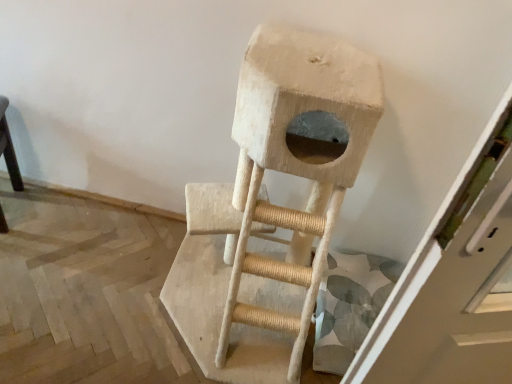
The width and height of the screenshot is (512, 384). What are the coordinates of `vacant space positioned to the left of natural wood cat tree at center` in the screenshot? It's located at (95, 278).